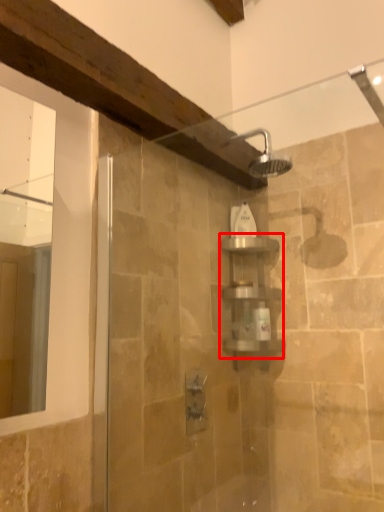
Question: Observing the image, what is the correct spatial positioning of shelf (annotated by the red box) in reference to toiletry?

Choices:
 (A) left
 (B) right

Answer: (B)